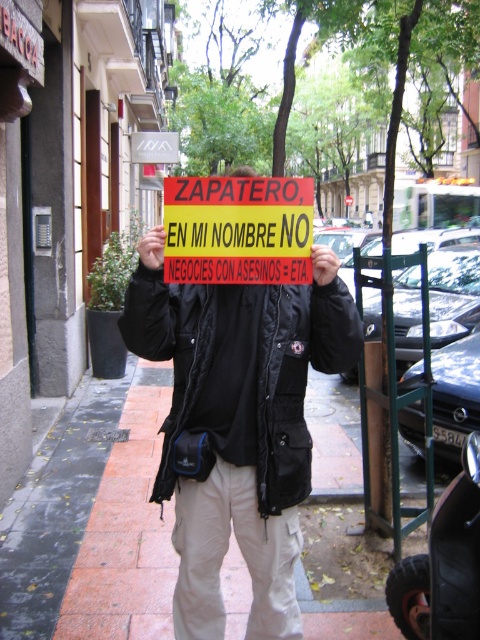
Question: Does black fabric jacket at center have a larger size compared to yellow paper sign at center?

Choices:
 (A) yes
 (B) no

Answer: (A)

Question: Which point is farther from the camera taking this photo?

Choices:
 (A) (216, 339)
 (B) (243, 208)

Answer: (A)

Question: Does black fabric jacket at center appear on the left side of yellow paper sign at center?

Choices:
 (A) yes
 (B) no

Answer: (A)

Question: From the image, what is the correct spatial relationship of black fabric jacket at center in relation to yellow paper sign at center?

Choices:
 (A) below
 (B) above

Answer: (A)